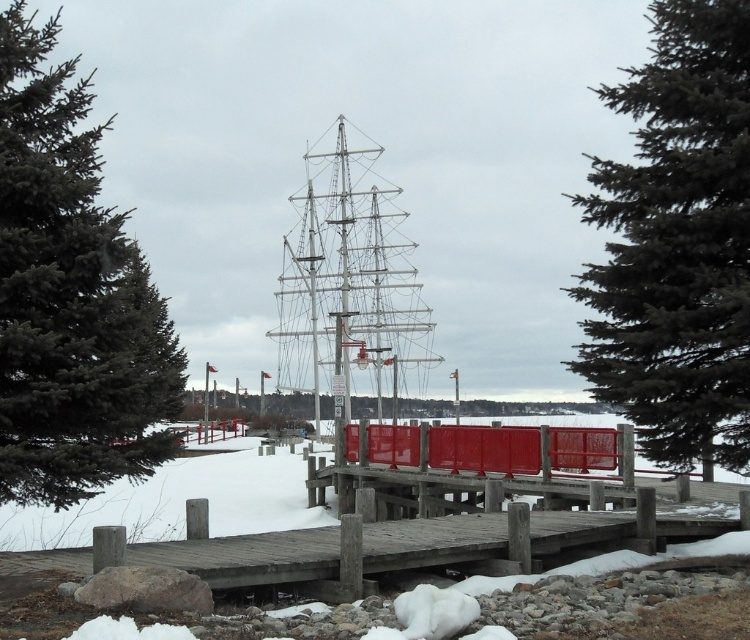
Is point (351, 177) positioned in front of point (276, 544)?

No, it is not.

Between white metallic boat at center and wooden dock at center, which one appears on the left side from the viewer's perspective?

From the viewer's perspective, white metallic boat at center appears more on the left side.

The width and height of the screenshot is (750, 640). In order to click on white metallic boat at center in this screenshot , I will do click(x=350, y=288).

Which is behind, point (78, 259) or point (309, 378)?

The point (309, 378) is more distant.

Is green matte tree at left bigger than white metallic boat at center?

Yes.

Identify the location of green matte tree at left. (70, 296).

Can you confirm if green matte tree at left is positioned below wooden dock at center?

No, green matte tree at left is not below wooden dock at center.

Which is in front, point (68, 104) or point (588, 477)?

Point (68, 104)

What do you see at coordinates (70, 296) in the screenshot? I see `green matte tree at left` at bounding box center [70, 296].

This screenshot has width=750, height=640. I want to click on green matte tree at left, so click(70, 296).